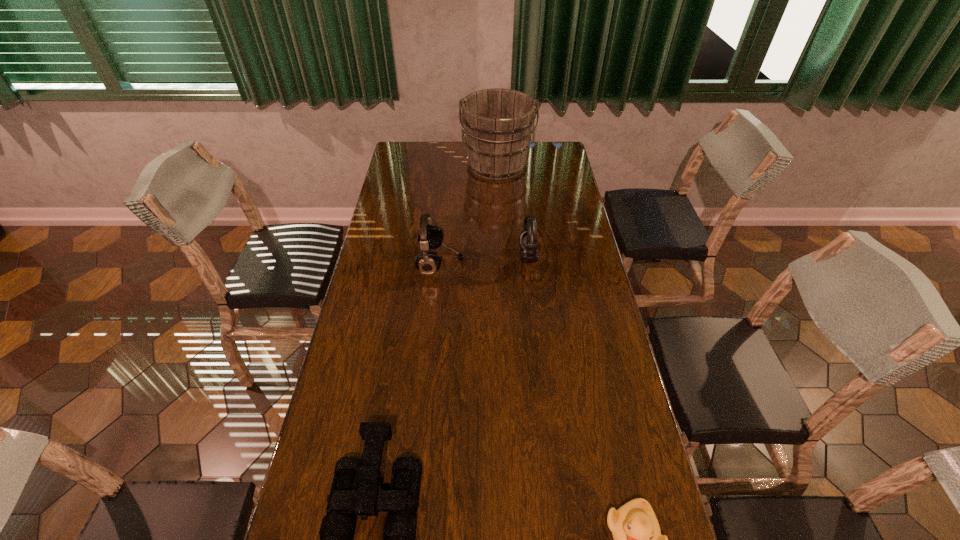
The height and width of the screenshot is (540, 960). I want to click on the tallest object, so click(497, 122).

Where is `bucket`? This screenshot has width=960, height=540. bucket is located at coordinates (497, 122).

I want to click on the second tallest object, so click(x=430, y=237).

You are a GUI agent. You are given a task and a screenshot of the screen. Output one action in this format:
    pyautogui.click(x=<x>, y=<y>)
    Task: Click on the left headset
    
    Given the screenshot: What is the action you would take?
    pyautogui.click(x=430, y=237)

The width and height of the screenshot is (960, 540). I want to click on the right headset, so [x=528, y=237].

Where is `vacant space located 0.320m on the handle side of the tallest object`? vacant space located 0.320m on the handle side of the tallest object is located at coordinates click(x=500, y=234).

Locate an element on the screen. The width and height of the screenshot is (960, 540). free point located 0.060m with the microphone on the side of the left headset is located at coordinates (480, 262).

Find the location of a particular element. vacant space located 0.050m on the earcups of the shorter headset is located at coordinates (505, 256).

You are a GUI agent. You are given a task and a screenshot of the screen. Output one action in this format:
    pyautogui.click(x=<x>, y=<y>)
    Task: Click on the free space located 0.140m on the earcups of the shorter headset
    
    Given the screenshot: What is the action you would take?
    pyautogui.click(x=480, y=256)

This screenshot has height=540, width=960. Find the location of `vacant space located on the earcups of the shorter headset`. vacant space located on the earcups of the shorter headset is located at coordinates (483, 256).